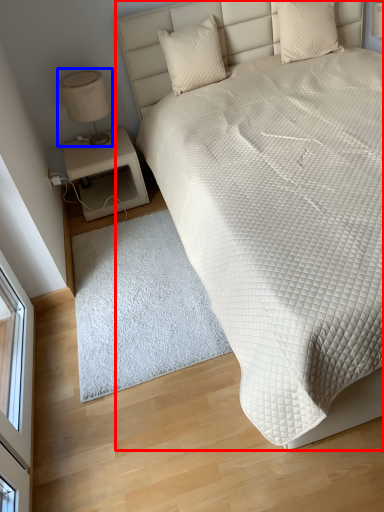
Question: Which object is closer to the camera taking this photo, bed (highlighted by a red box) or table lamp (highlighted by a blue box)?

Choices:
 (A) bed
 (B) table lamp

Answer: (A)